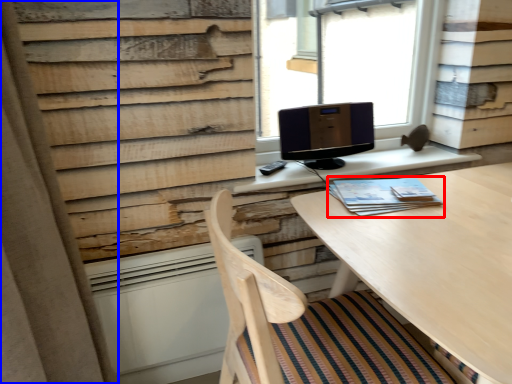
Question: Which point is closer to the camera, book (highlighted by a red box) or curtain (highlighted by a blue box)?

Choices:
 (A) book
 (B) curtain

Answer: (B)